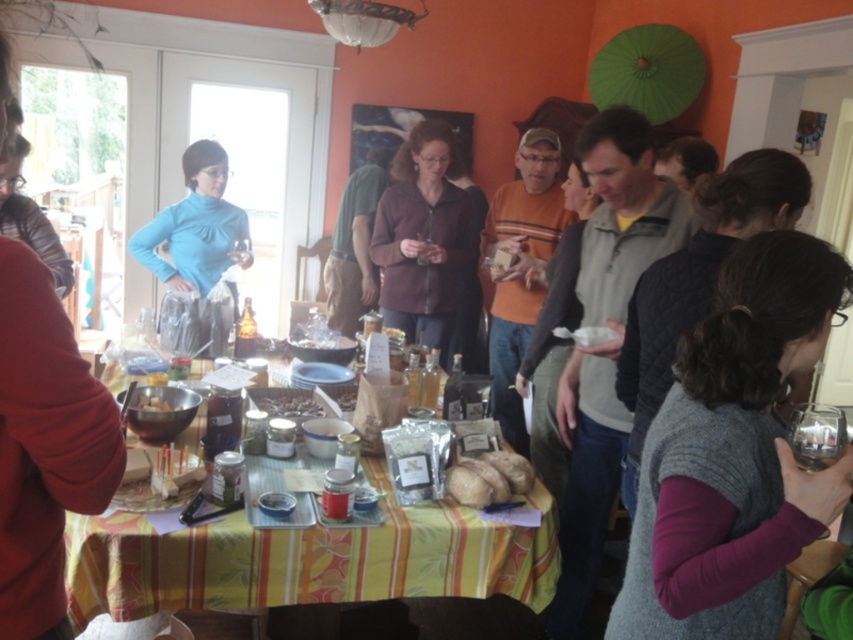
Question: Can you confirm if gray knitted vest at lower right is smaller than smooth brown nuts at center?

Choices:
 (A) yes
 (B) no

Answer: (B)

Question: Is yellow striped tablecloth at center bigger than matte blue sweater at left?

Choices:
 (A) no
 (B) yes

Answer: (A)

Question: Among these points, which one is farthest from the camera?

Choices:
 (A) (440, 579)
 (B) (165, 401)
 (C) (763, 620)

Answer: (B)

Question: Is gray knitted vest at lower right wider than smooth brown potato at center?

Choices:
 (A) yes
 (B) no

Answer: (A)

Question: Among these points, which one is nearest to the camera?

Choices:
 (A) (260, 476)
 (B) (161, 410)
 (C) (263, 406)

Answer: (A)

Question: Which point is closer to the camera taking this photo?

Choices:
 (A) (279, 396)
 (B) (157, 396)
 (C) (784, 376)

Answer: (C)